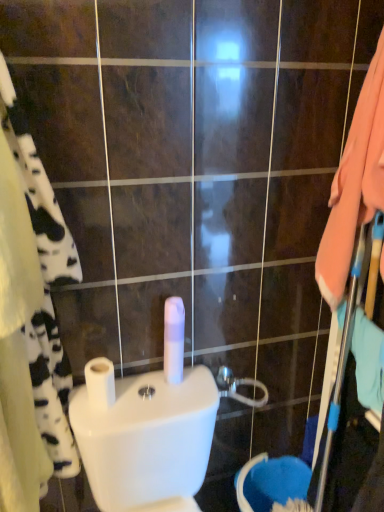
The height and width of the screenshot is (512, 384). What are the coordinates of `vacant point to the right of white matte toilet paper at center, marked as the 1th toilet paper in a left-to-right arrangement` in the screenshot? It's located at (151, 399).